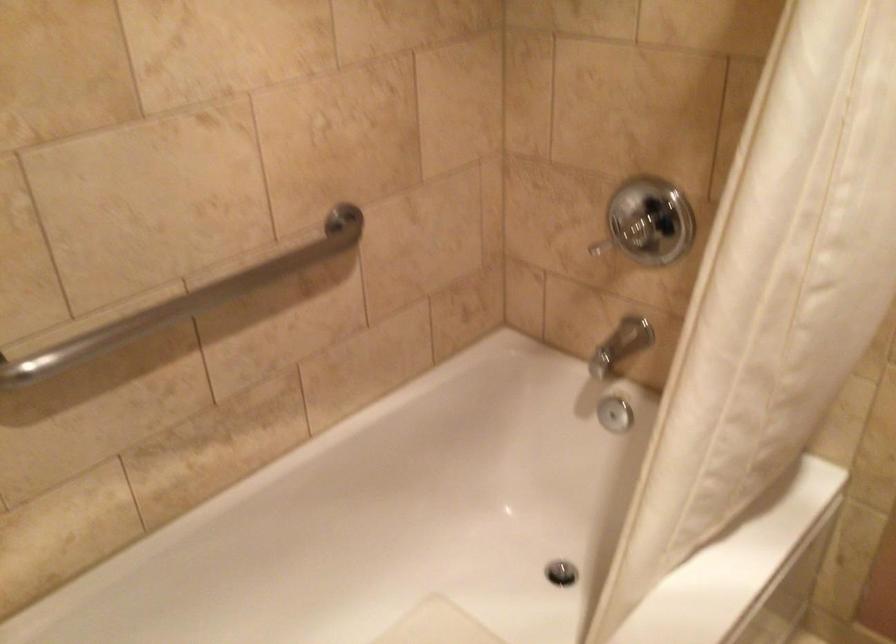
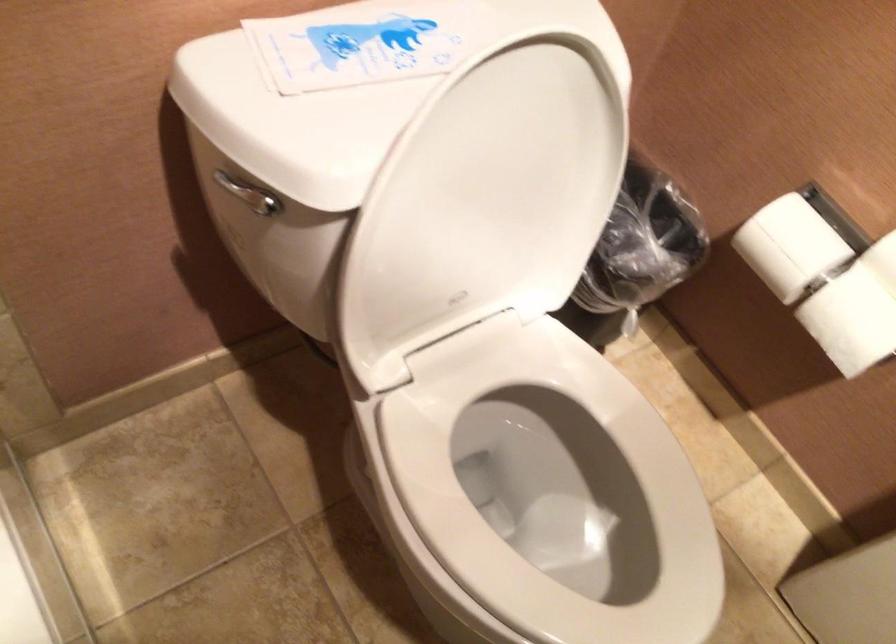
The images are taken continuously from a first-person perspective. In which direction is your viewpoint rotating?

The camera's rotation is toward right-down.